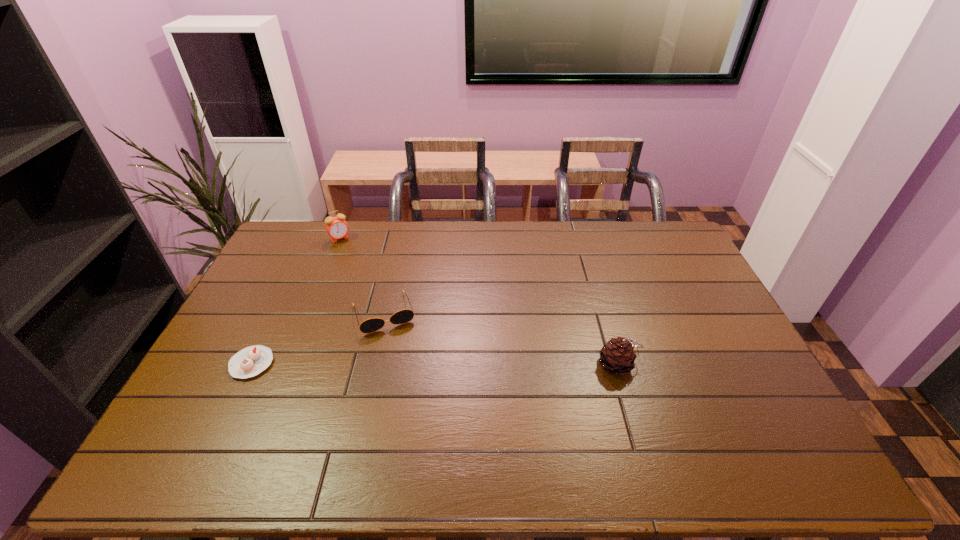
What are the coordinates of `the shortest object` in the screenshot? It's located at (250, 361).

You are a GUI agent. You are given a task and a screenshot of the screen. Output one action in this format:
    pyautogui.click(x=<x>, y=<y>)
    Task: Click on the cupcake
    This screenshot has width=960, height=540.
    Given the screenshot: What is the action you would take?
    pyautogui.click(x=250, y=361)

Find the location of a particular element. The width and height of the screenshot is (960, 540). pinecone is located at coordinates (617, 356).

You are a GUI agent. You are given a task and a screenshot of the screen. Output one action in this format:
    pyautogui.click(x=<x>, y=<y>)
    Task: Click on the third object from right to left
    
    Given the screenshot: What is the action you would take?
    pyautogui.click(x=337, y=228)

Identify the location of the farthest object. This screenshot has width=960, height=540. (337, 228).

The image size is (960, 540). I want to click on the second farthest object, so click(x=371, y=325).

Locate an element on the screen. the third object from left to right is located at coordinates (371, 325).

Locate an element on the screen. free space located on the right of the cupcake is located at coordinates (396, 363).

You are a GUI agent. You are given a task and a screenshot of the screen. Output one action in this format:
    pyautogui.click(x=<x>, y=<y>)
    Task: Click on the vacant space situated with a leaf charm attached to the pinecone
    Image resolution: width=960 pixels, height=540 pixels.
    Given the screenshot: What is the action you would take?
    pyautogui.click(x=661, y=364)

The height and width of the screenshot is (540, 960). I want to click on free region located on the face of the alarm clock, so click(361, 270).